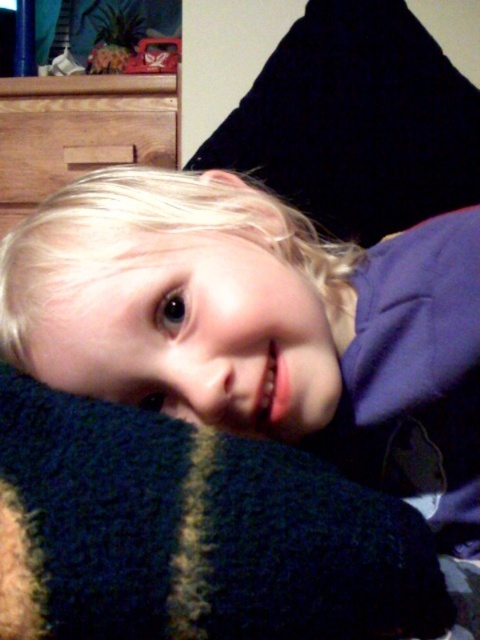
Between point (427, 273) and point (59, 621), which one is positioned behind?

The point (427, 273) is behind.

Does blonde hair at center have a lesser width compared to dark blue knitted blanket at center?

In fact, blonde hair at center might be wider than dark blue knitted blanket at center.

Locate an element on the screen. blonde hair at center is located at coordinates (257, 323).